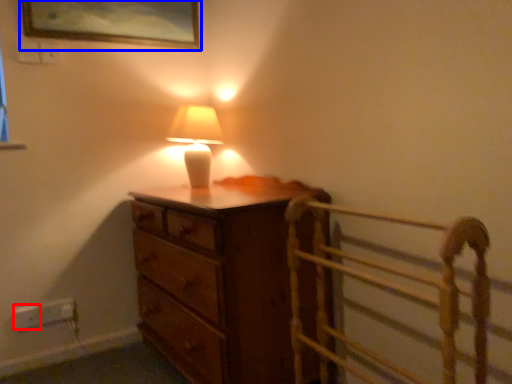
Question: Which object appears closest to the camera in this image, electric outlet (highlighted by a red box) or picture frame (highlighted by a blue box)?

Choices:
 (A) electric outlet
 (B) picture frame

Answer: (B)